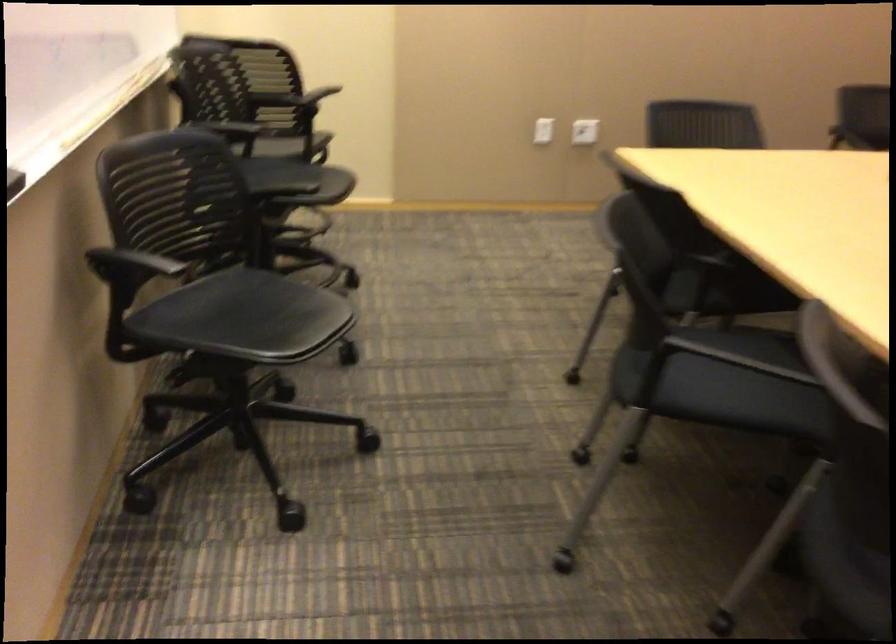
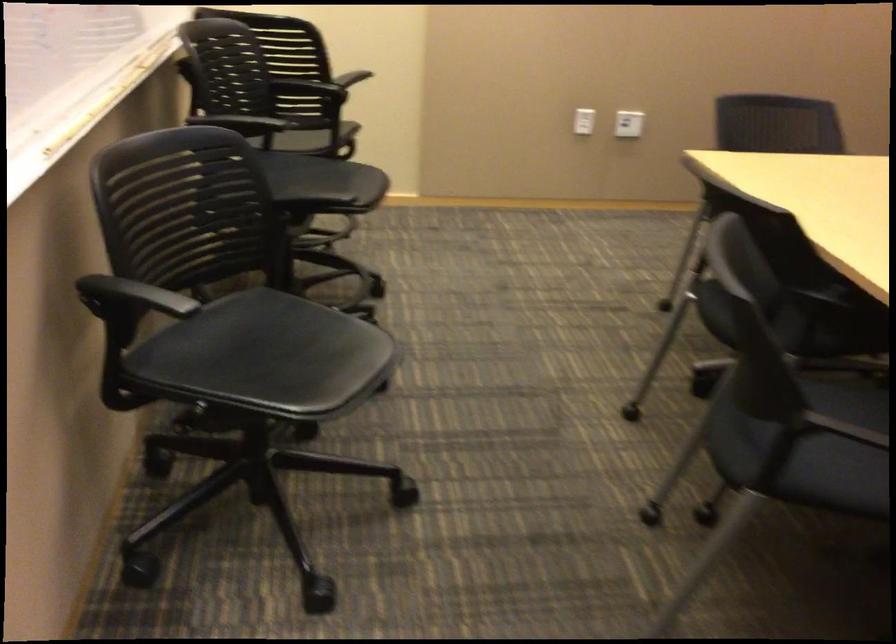
Find the pixel in the second image that matches [694,377] in the first image.

(804, 442)